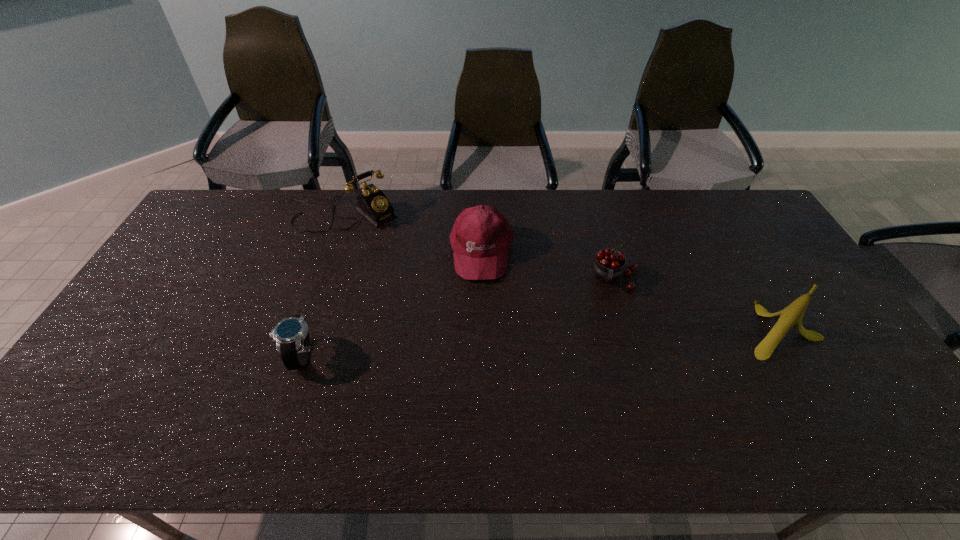
At what (x,y) coordinates should I click in order to perform the action: click on vacant position located 0.230m on the handle side of the second object from right to left. Please return your answer as a coordinate pair (x, y). The image size is (960, 540). Looking at the image, I should click on (612, 358).

I want to click on vacant space located on the handle side of the second object from right to left, so click(611, 370).

Locate an element on the screen. blank space located 0.350m on the handle side of the second object from right to left is located at coordinates (611, 399).

Identify the location of free space located at the front of the baseball cap with the brim. The height and width of the screenshot is (540, 960). (483, 357).

Where is `blank space located at the front of the baseball cap with the brim`? The width and height of the screenshot is (960, 540). blank space located at the front of the baseball cap with the brim is located at coordinates (483, 335).

Identify the location of vacant area situated 0.160m at the front of the baseball cap with the brim. (483, 327).

Where is `telephone located in the far edge section of the desktop`? The height and width of the screenshot is (540, 960). telephone located in the far edge section of the desktop is located at coordinates pos(372,203).

Identify the location of baseball cap present at the far edge. (481, 236).

This screenshot has width=960, height=540. I want to click on object that is at the near edge, so click(x=291, y=335).

Locate an element on the screen. object present at the right edge is located at coordinates (790, 317).